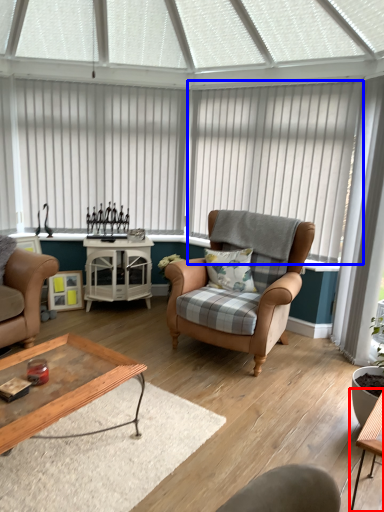
Question: Among these objects, which one is nearest to the camera, table (highlighted by a red box) or blind (highlighted by a blue box)?

Choices:
 (A) table
 (B) blind

Answer: (A)